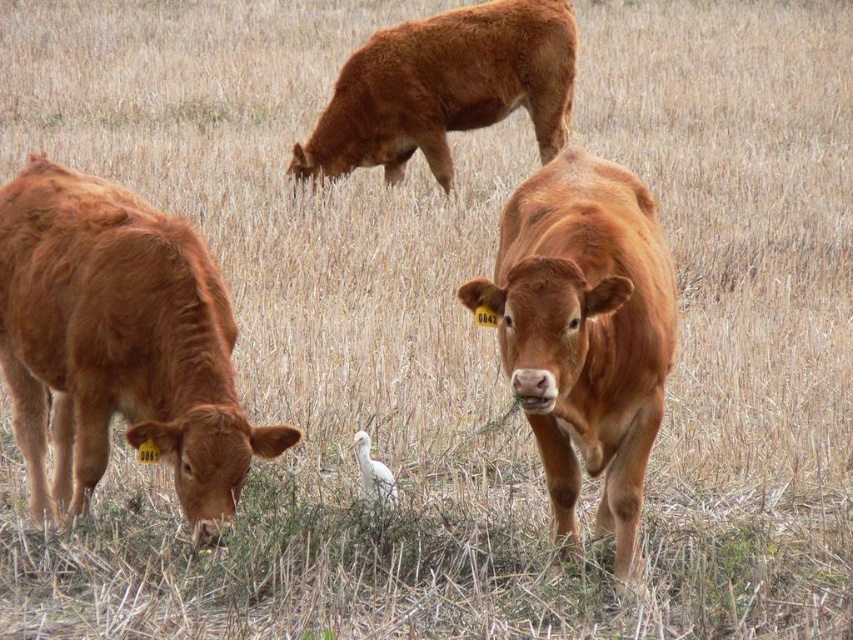
Question: Can you confirm if shiny brown cow at left is thinner than shiny brown cow at center?

Choices:
 (A) no
 (B) yes

Answer: (A)

Question: Which of the following is the closest to the observer?

Choices:
 (A) white matte bird at center
 (B) brown textured cow at upper center
 (C) shiny brown cow at center
 (D) shiny brown cow at left

Answer: (C)

Question: Which point appears farthest from the camera in this image?

Choices:
 (A) (538, 129)
 (B) (354, 442)

Answer: (A)

Question: Which object is the closest to the brown textured cow at upper center?

Choices:
 (A) white matte bird at center
 (B) shiny brown cow at center

Answer: (A)

Question: Considering the relative positions of shiny brown cow at center and brown textured cow at upper center in the image provided, where is shiny brown cow at center located with respect to brown textured cow at upper center?

Choices:
 (A) above
 (B) below

Answer: (B)

Question: Does shiny brown cow at left lie behind shiny brown cow at center?

Choices:
 (A) yes
 (B) no

Answer: (A)